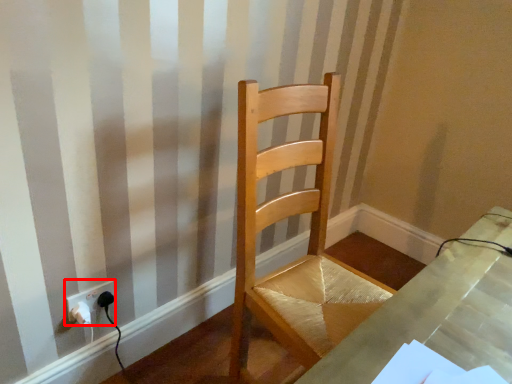
Question: Where is electric outlet (annotated by the red box) located in relation to chair in the image?

Choices:
 (A) left
 (B) right

Answer: (A)